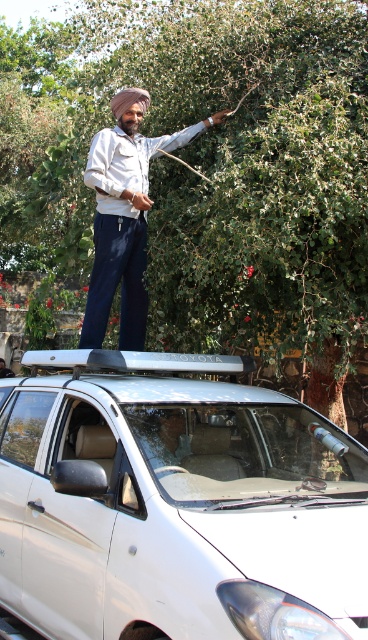
From the picture: Does green leafy tree at upper center appear on the left side of white matte car at upper center?

Correct, you'll find green leafy tree at upper center to the left of white matte car at upper center.

Who is lower down, green leafy tree at upper center or white matte car at upper center?

white matte car at upper center is below.

Where is `green leafy tree at upper center`? The image size is (368, 640). green leafy tree at upper center is located at coordinates (207, 166).

Is point (326, 134) more distant than point (195, 136)?

No, (326, 134) is closer to viewer.

Is the position of green leafy tree at upper center less distant than that of matte white shirt at center?

Yes.

Who is more forward, (281, 198) or (119, 97)?

Point (281, 198) is in front.

Where is `green leafy tree at upper center`? The image size is (368, 640). green leafy tree at upper center is located at coordinates (207, 166).

Who is positioned more to the right, white matte car at upper center or matte white shirt at center?

Positioned to the right is matte white shirt at center.

Is point (129, 378) positioned in front of point (125, 108)?

Yes, point (129, 378) is closer to viewer.

The height and width of the screenshot is (640, 368). Identify the location of white matte car at upper center. (175, 502).